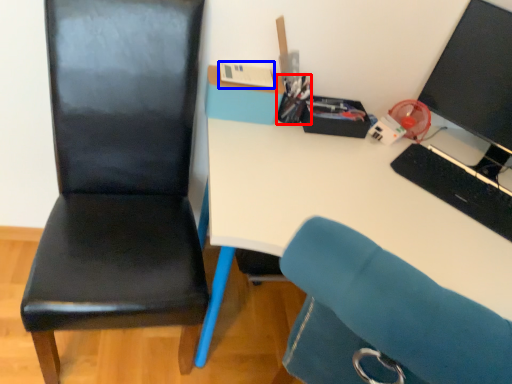
Question: Which object is further to the camera taking this photo, stationery (highlighted by a red box) or stationery (highlighted by a blue box)?

Choices:
 (A) stationery
 (B) stationery

Answer: (A)